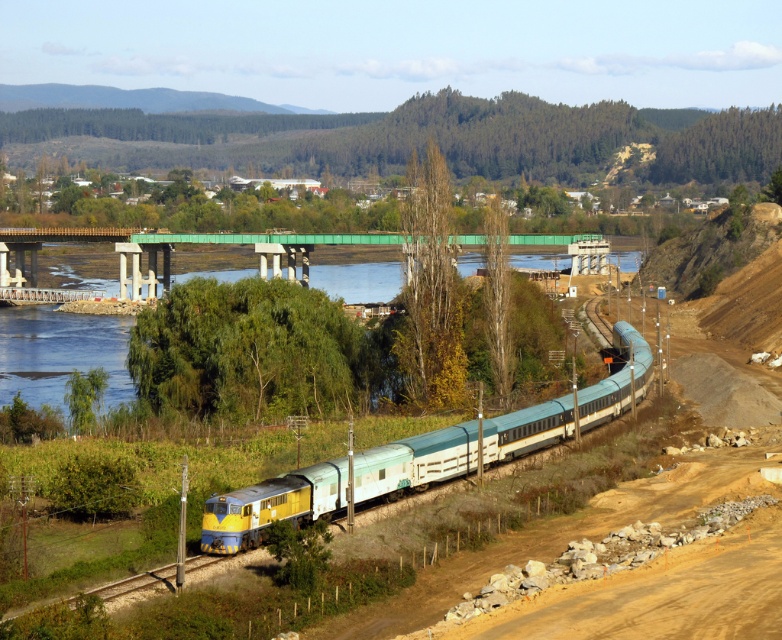
Question: Which of the following is the closest to the observer?

Choices:
 (A) (278, 500)
 (B) (149, 577)
 (C) (164, 280)

Answer: (B)

Question: Does yellow and blue painted train at center have a smaller size compared to green concrete bridge at center?

Choices:
 (A) no
 (B) yes

Answer: (B)

Question: Which point appears closest to the camera in this image?

Choices:
 (A) (237, 540)
 (B) (458, 237)
 (C) (158, 573)

Answer: (C)

Question: Can you confirm if green concrete bridge at center is positioned above yellow metallic train track at lower left?

Choices:
 (A) no
 (B) yes

Answer: (B)

Question: Which point is closer to the camera?

Choices:
 (A) green concrete bridge at center
 (B) yellow metallic train track at lower left
 (C) yellow and blue painted train at center

Answer: (B)

Question: Is green concrete bridge at center positioned behind yellow metallic train track at lower left?

Choices:
 (A) yes
 (B) no

Answer: (A)